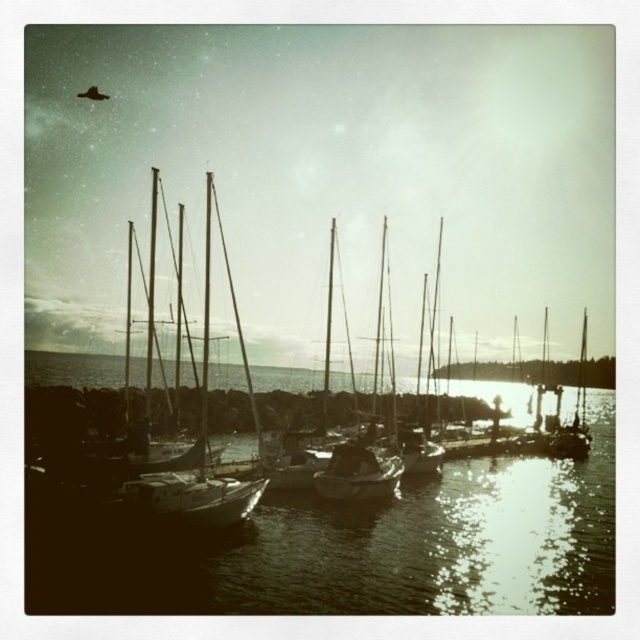
You are a photographer trying to capture the reflection of the matte white boat at center in the sepia reflective water at center. Based on the scene description, can you confirm if the reflection will be fully visible within the water?

The sepia reflective water at center is bigger than the matte white boat at center, so the reflection of the matte white boat at center should be fully visible within the water.